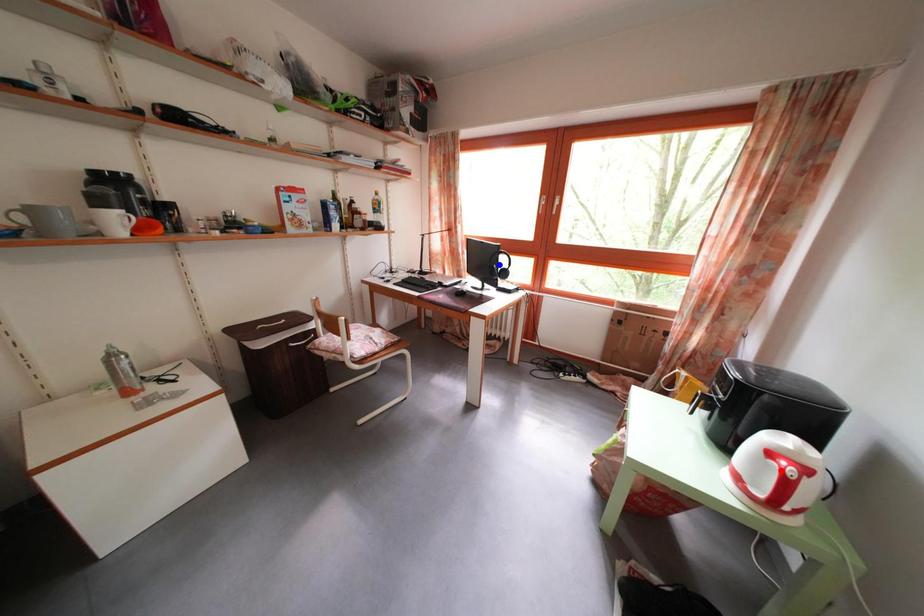
Question: Two points are marked on the image. Which point is closer to the camera?

Choices:
 (A) Blue point is closer.
 (B) Red point is closer.

Answer: (B)